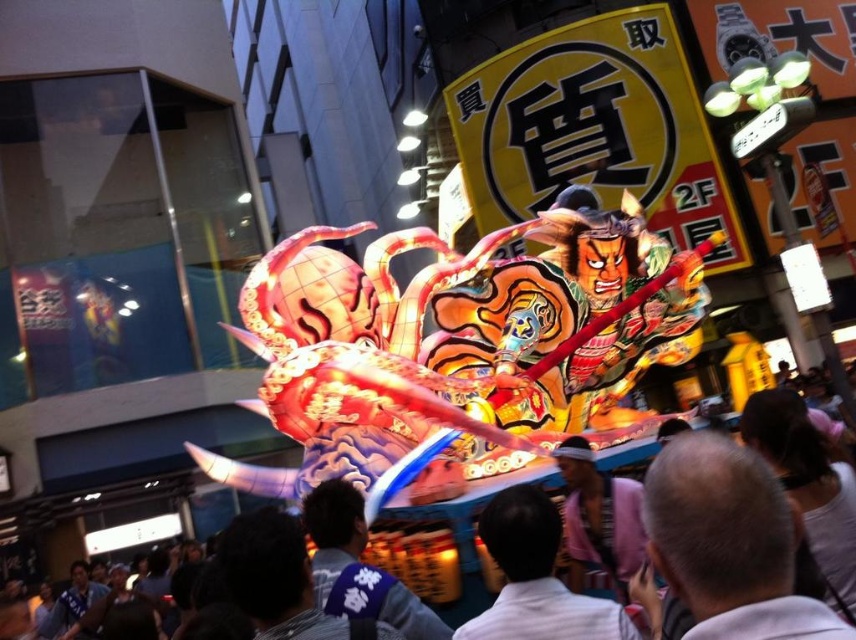
Between gray hair at lower right and dark blue fabric at center, which one has more height?

gray hair at lower right is taller.

Does gray hair at lower right have a lesser width compared to dark blue fabric at center?

Indeed, gray hair at lower right has a lesser width compared to dark blue fabric at center.

Is point (752, 566) farther from camera compared to point (336, 584)?

No, (752, 566) is closer to viewer.

At what (x,y) coordinates should I click in order to perform the action: click on gray hair at lower right. Please return your answer as a coordinate pair (x, y). The width and height of the screenshot is (856, 640). Looking at the image, I should click on (730, 541).

Is white cotton shirt at lower center further to camera compared to pink satin jacket at center?

No, it is in front of pink satin jacket at center.

Find the location of a particular element. white cotton shirt at lower center is located at coordinates (536, 577).

Does point (730, 493) come behind point (542, 634)?

No.

Is point (759, 467) in front of point (538, 611)?

Yes, point (759, 467) is in front of point (538, 611).

This screenshot has height=640, width=856. I want to click on gray hair at lower right, so click(730, 541).